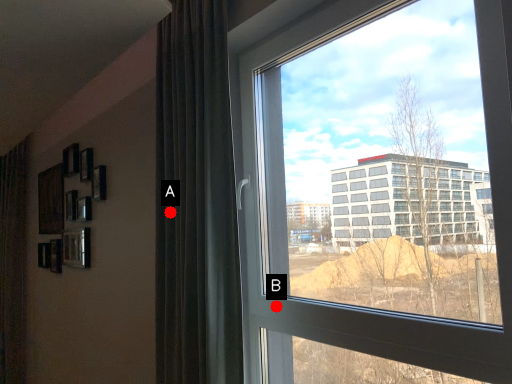
Question: Two points are circled on the image, labeled by A and B beside each circle. Which point appears farthest from the camera in this image?

Choices:
 (A) A is further
 (B) B is further

Answer: (A)